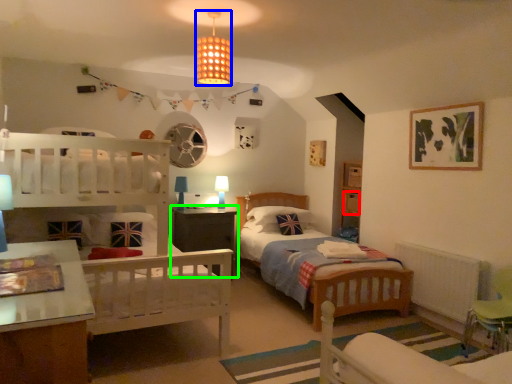
Question: Based on their relative distances, which object is farther from drawer (highlighted by a red box)? Choose from lighting (highlighted by a blue box) and nightstand (highlighted by a green box).

Choices:
 (A) lighting
 (B) nightstand

Answer: (A)